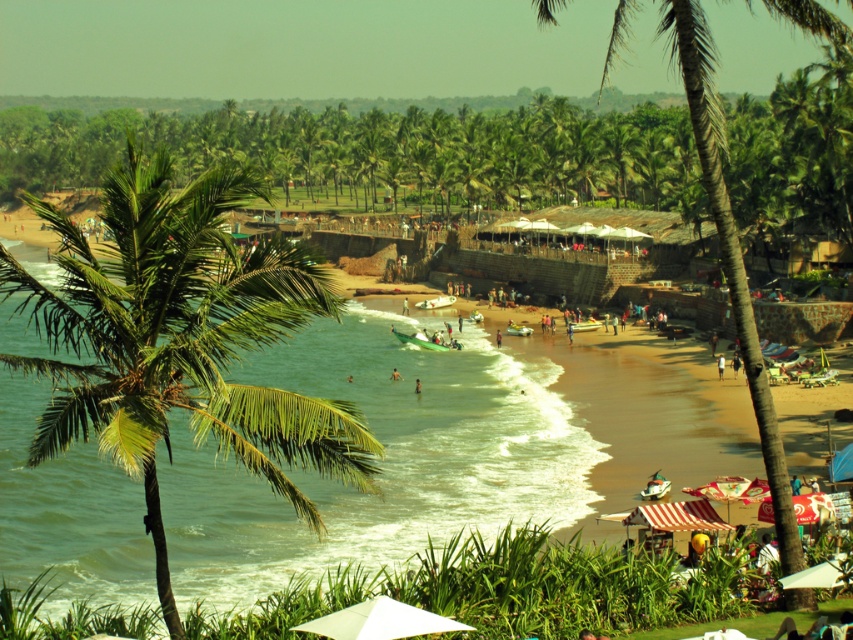
Question: Can you confirm if white matte umbrella at lower center is wider than skinny person at center?

Choices:
 (A) no
 (B) yes

Answer: (B)

Question: Which point is farther from the camera taking this photo?

Choices:
 (A) (339, 304)
 (B) (392, 371)
 (C) (427, 628)

Answer: (B)

Question: Among these points, which one is nearest to the camera?

Choices:
 (A) (752, 364)
 (B) (119, 266)
 (C) (370, 627)

Answer: (C)

Question: Which point is farther to the camera?

Choices:
 (A) white matte umbrella at lower center
 (B) dark skin human at center
 (C) white cotton shirt at center

Answer: (B)

Question: Is white matte umbrella at lower center wider than white cotton shirt at center?

Choices:
 (A) no
 (B) yes

Answer: (B)

Question: Does white matte umbrella at lower center appear on the left side of white cotton shirt at center?

Choices:
 (A) no
 (B) yes

Answer: (B)